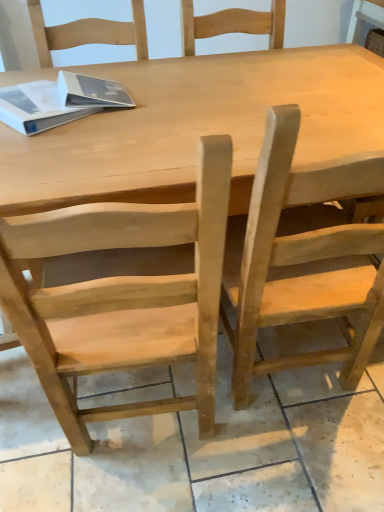
What are the coordinates of `free region under natural wood chair at center, the first chair when ordered from left to right (from a real-world perspective)` in the screenshot? It's located at (135, 426).